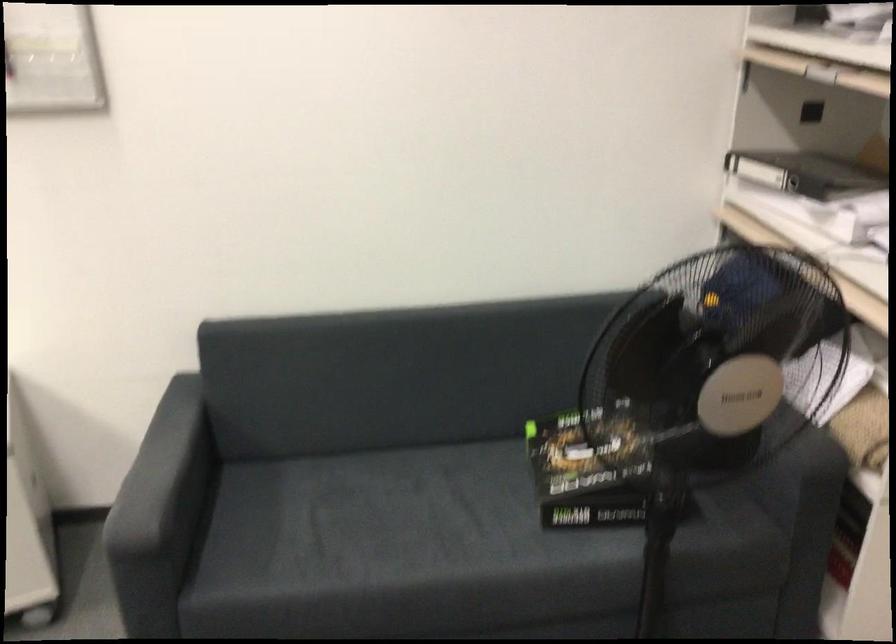
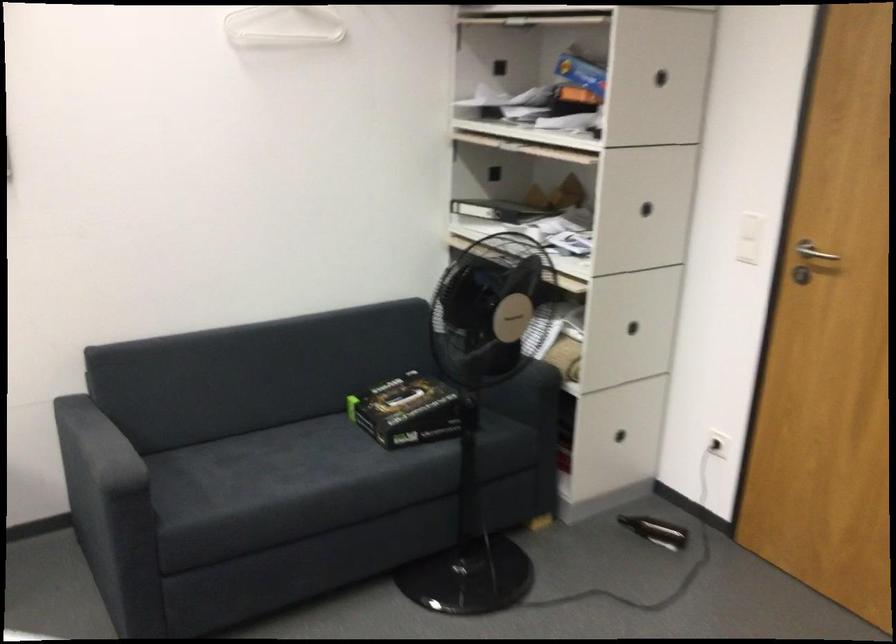
Locate, in the second image, the point that corresponds to the point at 383,509 in the first image.

(268, 462)